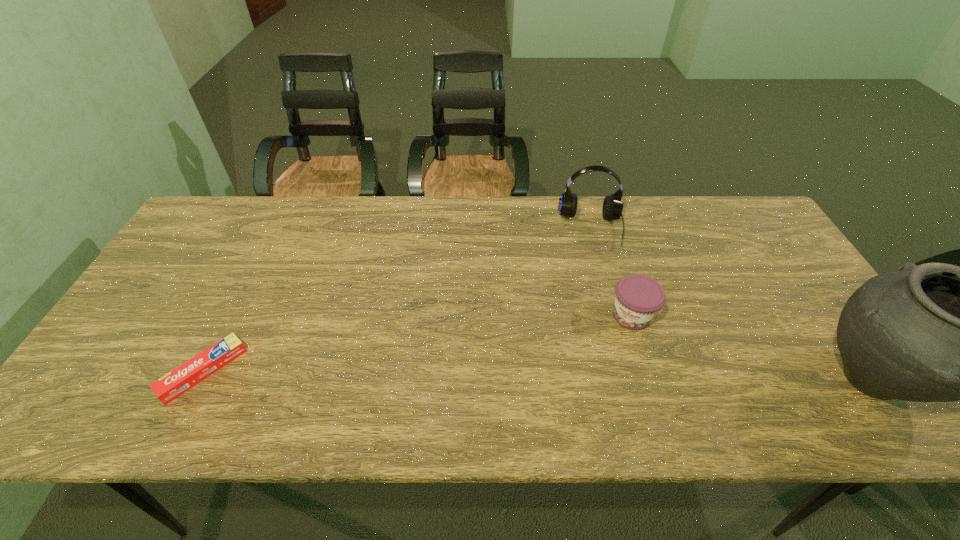
Identify the location of the shortest object. The width and height of the screenshot is (960, 540). (178, 381).

This screenshot has height=540, width=960. In order to click on the leftmost object in this screenshot , I will do `click(178, 381)`.

Identify the location of jam. The height and width of the screenshot is (540, 960). (638, 298).

You are a GUI agent. You are given a task and a screenshot of the screen. Output one action in this format:
    pyautogui.click(x=<x>, y=<y>)
    Task: Click on the third shortest object
    The height and width of the screenshot is (540, 960).
    Given the screenshot: What is the action you would take?
    pyautogui.click(x=612, y=208)

Identify the location of the farthest object. The height and width of the screenshot is (540, 960). [x=612, y=208].

This screenshot has width=960, height=540. I want to click on blank space located 0.190m on the back of the toothpaste, so click(x=248, y=285).

Image resolution: width=960 pixels, height=540 pixels. In order to click on free space located 0.140m on the front label of the jam in this screenshot , I will do `click(601, 372)`.

This screenshot has width=960, height=540. Identify the location of free spot located 0.190m on the front label of the jam. (592, 387).

Where is `vacant space located on the front label of the jam`? The height and width of the screenshot is (540, 960). vacant space located on the front label of the jam is located at coordinates (612, 354).

At what (x,y) coordinates should I click in order to perform the action: click on free space located 0.370m on the ear cushions of the headset. Please return your answer as a coordinate pair (x, y). Looking at the image, I should click on (604, 354).